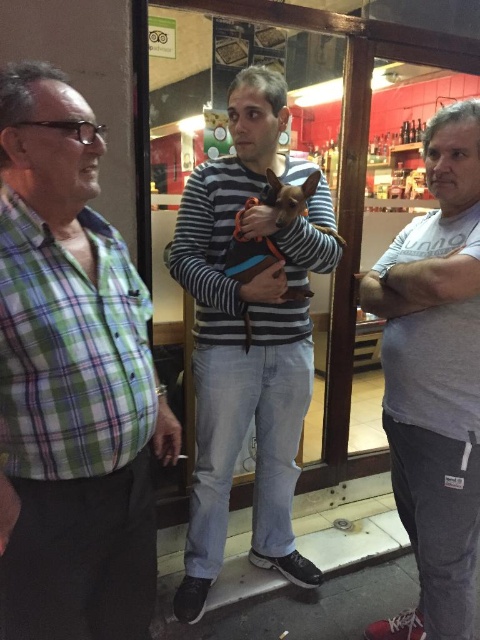
Question: Which point is farther to the camera?

Choices:
 (A) (279, 572)
 (B) (427, 273)
 (C) (82, 561)
 (D) (288, 296)

Answer: (A)

Question: Which of the following is the closest to the observer?

Choices:
 (A) (291, 454)
 (B) (406, 394)
 (C) (274, 196)
 (D) (147, 518)

Answer: (D)

Question: Does green plaid shirt at left appear under skinny jeans at center?

Choices:
 (A) yes
 (B) no

Answer: (A)

Question: Does gray cotton t-shirt at right appear over brown fabric dog at center?

Choices:
 (A) no
 (B) yes

Answer: (A)

Question: Does striped sweater at center have a larger size compared to gray cotton t-shirt at right?

Choices:
 (A) yes
 (B) no

Answer: (A)

Question: Estimate the real-world distances between objects in this image. Which object is closer to the green plaid shirt at left?

Choices:
 (A) brown fabric dog at center
 (B) striped sweater at center
 (C) gray cotton t-shirt at right

Answer: (A)